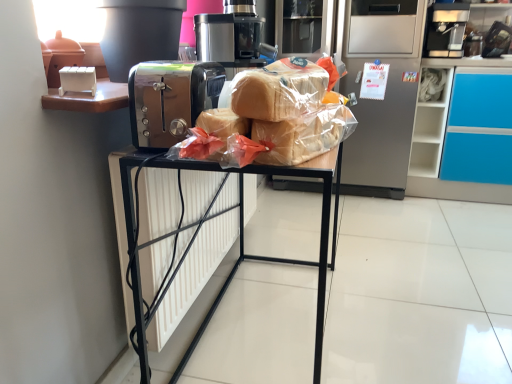
Find the location of a particular element. free space above satin chrome toaster at center (from a real-world perspective) is located at coordinates (187, 64).